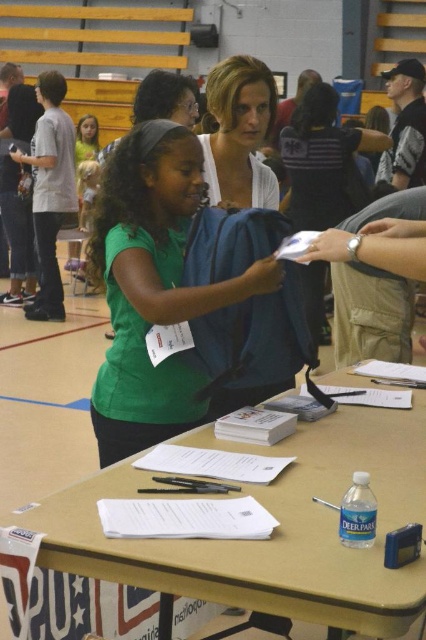
Question: Does green matte shirt at center lie behind matte white blouse at center?

Choices:
 (A) yes
 (B) no

Answer: (B)

Question: Does matte plastic table at center have a greater width compared to green matte shirt at center?

Choices:
 (A) no
 (B) yes

Answer: (B)

Question: Which point is closer to the camera taking this photo?

Choices:
 (A) (267, 177)
 (B) (192, 544)

Answer: (B)

Question: Which of the following is the closest to the observer?

Choices:
 (A) matte white blouse at center
 (B) matte plastic table at center
 (C) green matte shirt at center

Answer: (B)

Question: Can you confirm if matte plastic table at center is positioned to the right of matte white blouse at center?

Choices:
 (A) yes
 (B) no

Answer: (A)

Question: Which point is closer to the camera?

Choices:
 (A) (175, 385)
 (B) (322, 529)

Answer: (B)